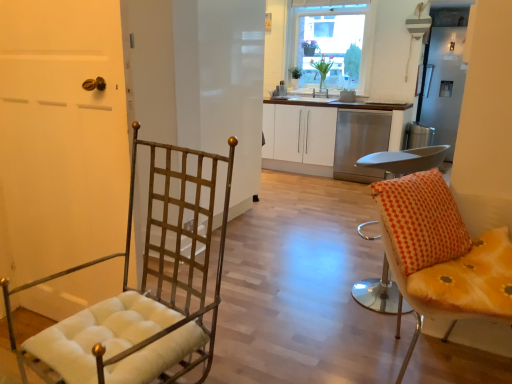
At what (x,y) coordinates should I click in order to perform the action: click on orange fabric cushioned stool at right, marked as the 2th chair in a left-to-right arrangement. Please return your answer as a coordinate pair (x, y). Looking at the image, I should click on (405, 160).

In order to face green leafy plant at upper center, arranged as the 2th houseplant when viewed from the left, should I rotate leftwards or rightwards?

Rotate right and turn 9.217 degrees.

Locate an element on the screen. This screenshot has height=384, width=512. white matte cabinet at center is located at coordinates (298, 139).

Describe the element at coordinates (298, 139) in the screenshot. I see `white matte cabinet at center` at that location.

I want to click on satin silver refrigerator at upper right, which is the first screen door in right-to-left order, so click(x=445, y=75).

Where is `orange fabric cushioned stool at right, marked as the 2th chair in a left-to-right arrangement`? orange fabric cushioned stool at right, marked as the 2th chair in a left-to-right arrangement is located at coordinates (405, 160).

Could you measure the distance between satin silver refrigerator at upper right, which appears as the first screen door when viewed from the back, and yellow fabric cushion at right, marked as the 3th chair in a left-to-right arrangement?

4.37 meters.

In the image, is satin silver refrigerator at upper right, which appears as the first screen door when viewed from the back, on the left side or the right side of yellow fabric cushion at right, which is the 1th chair in right-to-left order?

satin silver refrigerator at upper right, which appears as the first screen door when viewed from the back, is positioned on yellow fabric cushion at right, which is the 1th chair in right-to-left order,'s right side.

Between satin silver refrigerator at upper right, which is the first screen door in right-to-left order, and yellow fabric cushion at right, marked as the 3th chair in a left-to-right arrangement, which one is positioned behind?

satin silver refrigerator at upper right, which is the first screen door in right-to-left order, is further from the camera.

Is yellow fabric cushion at right, marked as the 3th chair in a left-to-right arrangement, at the back of satin silver refrigerator at upper right, which is the first screen door in right-to-left order?

satin silver refrigerator at upper right, which is the first screen door in right-to-left order, is not turned away from yellow fabric cushion at right, marked as the 3th chair in a left-to-right arrangement.

Considering the sizes of objects matte gold door at left and clear glass window at upper center in the image provided, who is shorter, matte gold door at left or clear glass window at upper center?

Standing shorter between the two is matte gold door at left.

How many degrees apart are the facing directions of matte gold door at left and clear glass window at upper center?

matte gold door at left and clear glass window at upper center are facing 179 degrees away from each other.

Is the depth of matte gold door at left less than that of clear glass window at upper center?

Yes, it is in front of clear glass window at upper center.

Is matte gold door at left oriented towards clear glass window at upper center?

Yes, matte gold door at left is turned towards clear glass window at upper center.

Is clear glass window at upper center facing away from yellow fabric cushion at right, marked as the 3th chair in a left-to-right arrangement?

That's not correct — clear glass window at upper center is not looking away from yellow fabric cushion at right, marked as the 3th chair in a left-to-right arrangement.

From the image's perspective, which is below, clear glass window at upper center or yellow fabric cushion at right, marked as the 3th chair in a left-to-right arrangement?

From the image's view, yellow fabric cushion at right, marked as the 3th chair in a left-to-right arrangement, is below.

Is the surface of clear glass window at upper center in direct contact with yellow fabric cushion at right, marked as the 3th chair in a left-to-right arrangement?

clear glass window at upper center and yellow fabric cushion at right, marked as the 3th chair in a left-to-right arrangement, are clearly separated.

Which is more to the left, clear glass window at upper center or yellow fabric cushion at right, marked as the 3th chair in a left-to-right arrangement?

Positioned to the left is yellow fabric cushion at right, marked as the 3th chair in a left-to-right arrangement.

How distant is clear glass window at upper center from orange fabric cushioned stool at right, arranged as the 2th chair when viewed from the right?

clear glass window at upper center is 3.77 meters from orange fabric cushioned stool at right, arranged as the 2th chair when viewed from the right.

Who is smaller, clear glass window at upper center or orange fabric cushioned stool at right, marked as the 2th chair in a left-to-right arrangement?

orange fabric cushioned stool at right, marked as the 2th chair in a left-to-right arrangement.

Is clear glass window at upper center wider or thinner than orange fabric cushioned stool at right, arranged as the 2th chair when viewed from the right?

In the image, clear glass window at upper center appears to be more narrow than orange fabric cushioned stool at right, arranged as the 2th chair when viewed from the right.

From a real-world perspective, is clear glass window at upper center below orange fabric cushioned stool at right, marked as the 2th chair in a left-to-right arrangement?

No, from a real-world perspective, clear glass window at upper center is not below orange fabric cushioned stool at right, marked as the 2th chair in a left-to-right arrangement.

Is yellow fabric cushion at right, marked as the 3th chair in a left-to-right arrangement, to the left or to the right of satin silver refrigerator at upper right, which appears as the first screen door when viewed from the back, in the image?

yellow fabric cushion at right, marked as the 3th chair in a left-to-right arrangement, is to the left of satin silver refrigerator at upper right, which appears as the first screen door when viewed from the back.

Could you tell me if yellow fabric cushion at right, which is the 1th chair in right-to-left order, is facing satin silver refrigerator at upper right, which appears as the first screen door when viewed from the back?

No, yellow fabric cushion at right, which is the 1th chair in right-to-left order, is not facing towards satin silver refrigerator at upper right, which appears as the first screen door when viewed from the back.

How distant is yellow fabric cushion at right, which is the 1th chair in right-to-left order, from satin silver refrigerator at upper right, which appears as the first screen door when viewed from the back?

They are 14.34 feet apart.

From a real-world perspective, which is physically below, yellow fabric cushion at right, marked as the 3th chair in a left-to-right arrangement, or satin silver refrigerator at upper right, which appears as the first screen door when viewed from the back?

yellow fabric cushion at right, marked as the 3th chair in a left-to-right arrangement.

In the image, is white matte cabinet at center positioned in front of or behind green leafy plant at upper center, the 2th houseplant when ordered from right to left?

Visually, white matte cabinet at center is located in front of green leafy plant at upper center, the 2th houseplant when ordered from right to left.

Between white matte cabinet at center and green leafy plant at upper center, the first houseplant positioned from the left, which one has smaller width?

With smaller width is green leafy plant at upper center, the first houseplant positioned from the left.

How much distance is there between white matte cabinet at center and green leafy plant at upper center, the 2th houseplant when ordered from right to left?

A distance of 34.91 inches exists between white matte cabinet at center and green leafy plant at upper center, the 2th houseplant when ordered from right to left.

Considering the relative positions of green leafy plant at upper center, arranged as the 2th houseplant when viewed from the left, and clear glass window at upper center in the image provided, is green leafy plant at upper center, arranged as the 2th houseplant when viewed from the left, to the left of clear glass window at upper center from the viewer's perspective?

Indeed, green leafy plant at upper center, arranged as the 2th houseplant when viewed from the left, is positioned on the left side of clear glass window at upper center.

Which is correct: green leafy plant at upper center, arranged as the 2th houseplant when viewed from the left, is inside clear glass window at upper center, or outside of it?

green leafy plant at upper center, arranged as the 2th houseplant when viewed from the left, is inside clear glass window at upper center.

Considering the relative sizes of green leafy plant at upper center, the 1th houseplant in the right-to-left sequence, and clear glass window at upper center in the image provided, is green leafy plant at upper center, the 1th houseplant in the right-to-left sequence, wider than clear glass window at upper center?

Indeed, green leafy plant at upper center, the 1th houseplant in the right-to-left sequence, has a greater width compared to clear glass window at upper center.

What are the coordinates of `chair that is the 1st object to the left of the satin silver refrigerator at upper right, which ranks as the second screen door in front-to-back order, starting at the anchor` in the screenshot? It's located at (441, 253).

What are the coordinates of `window on the right side of matte gold door at left` in the screenshot? It's located at (323, 29).

Considering their positions, is green leafy plant at upper center, arranged as the 2th houseplant when viewed from the left, positioned further to white matte cabinet at center than clear glass window at upper center?

The object further to white matte cabinet at center is clear glass window at upper center.

From the image, which object appears to be nearer to white matte cabinet at center, green leafy plant at upper center, the 1th houseplant in the right-to-left sequence, or matte gold door at left?

green leafy plant at upper center, the 1th houseplant in the right-to-left sequence, lies closer to white matte cabinet at center than the other object.

Estimate the real-world distances between objects in this image. Which object is further from orange fabric cushioned stool at right, marked as the 2th chair in a left-to-right arrangement, metallic gold chair at left, the third chair in the right-to-left sequence, or metallic grid screen door at center, which appears as the 1th screen door when viewed from the front?

metallic grid screen door at center, which appears as the 1th screen door when viewed from the front, is positioned further to the anchor orange fabric cushioned stool at right, marked as the 2th chair in a left-to-right arrangement.

Based on their spatial positions, is clear glass window at upper center or green leafy plant at upper center, the first houseplant positioned from the left, closer to white matte cabinet at center?

Among the two, green leafy plant at upper center, the first houseplant positioned from the left, is located nearer to white matte cabinet at center.

From the image, which object appears to be nearer to yellow fabric cushion at right, which is the 1th chair in right-to-left order, metallic grid screen door at center, which appears as the 1th screen door when viewed from the front, or orange fabric cushioned stool at right, arranged as the 2th chair when viewed from the right?

Among the two, orange fabric cushioned stool at right, arranged as the 2th chair when viewed from the right, is located nearer to yellow fabric cushion at right, which is the 1th chair in right-to-left order.

When comparing their distances from matte gold door at left, does satin silver refrigerator at upper right, which is the first screen door in right-to-left order, or clear glass window at upper center seem further?

Among the two, satin silver refrigerator at upper right, which is the first screen door in right-to-left order, is located further to matte gold door at left.

Considering their positions, is matte gold door at left positioned further to satin silver refrigerator at upper right, which ranks as the second screen door in front-to-back order, than white matte cabinet at center?

matte gold door at left is further to satin silver refrigerator at upper right, which ranks as the second screen door in front-to-back order.

Considering their positions, is clear glass window at upper center positioned further to white matte cabinet at center than satin silver refrigerator at upper right, which ranks as the second screen door in front-to-back order?

satin silver refrigerator at upper right, which ranks as the second screen door in front-to-back order, is further to white matte cabinet at center.

The image size is (512, 384). I want to click on door between metallic gold chair at left, the third chair in the right-to-left sequence, and metallic grid screen door at center, the first screen door viewed from the left, along the z-axis, so click(61, 136).

Identify the location of cabinetry between yellow fabric cushion at right, which is the 1th chair in right-to-left order, and satin silver refrigerator at upper right, which appears as the first screen door when viewed from the back, along the z-axis. The height and width of the screenshot is (384, 512). (298, 139).

Where is `screen door between orange fabric cushioned stool at right, arranged as the 2th chair when viewed from the right, and green leafy plant at upper center, arranged as the 2th houseplant when viewed from the left, along the z-axis`? screen door between orange fabric cushioned stool at right, arranged as the 2th chair when viewed from the right, and green leafy plant at upper center, arranged as the 2th houseplant when viewed from the left, along the z-axis is located at coordinates (232, 86).

This screenshot has height=384, width=512. What are the coordinates of `window positioned between matte gold door at left and green leafy plant at upper center, the 1th houseplant in the right-to-left sequence, from near to far` in the screenshot? It's located at (323, 29).